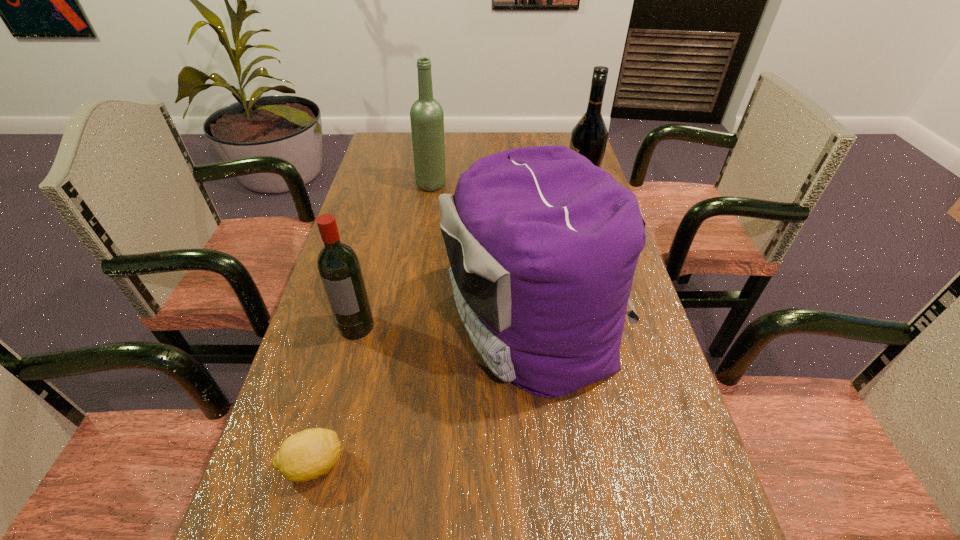
Where is `the second closest object relative to the third object from left to right`? the second closest object relative to the third object from left to right is located at coordinates (589, 137).

Identify which object is located as the fourth nearest to the backpack. Please provide its 2D coordinates. Your answer should be formatted as a tuple, i.e. [(x, y)], where the tuple contains the x and y coordinates of a point satisfying the conditions above.

[(426, 115)]

Identify which wine bottle is located as the nearest to the second wine bottle from right to left. Please provide its 2D coordinates. Your answer should be formatted as a tuple, i.e. [(x, y)], where the tuple contains the x and y coordinates of a point satisfying the conditions above.

[(589, 137)]

Where is `wine bottle that stands as the second closest to the third object from right to left`? wine bottle that stands as the second closest to the third object from right to left is located at coordinates (339, 268).

Find the location of a particular element. This screenshot has height=540, width=960. vacant area in the image that satisfies the following two spatial constraints: 1. on the label of the rightmost wine bottle; 2. on the label of the nearest wine bottle is located at coordinates (620, 326).